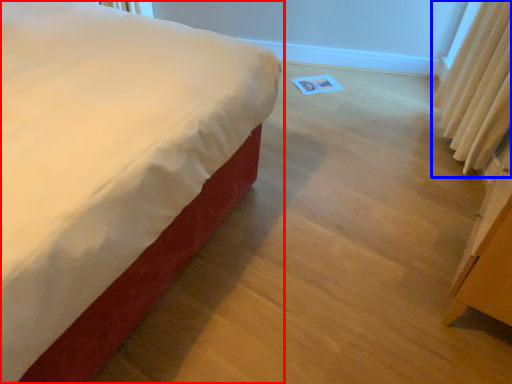
Question: Which object appears closest to the camera in this image, bed (highlighted by a red box) or curtain (highlighted by a blue box)?

Choices:
 (A) bed
 (B) curtain

Answer: (A)